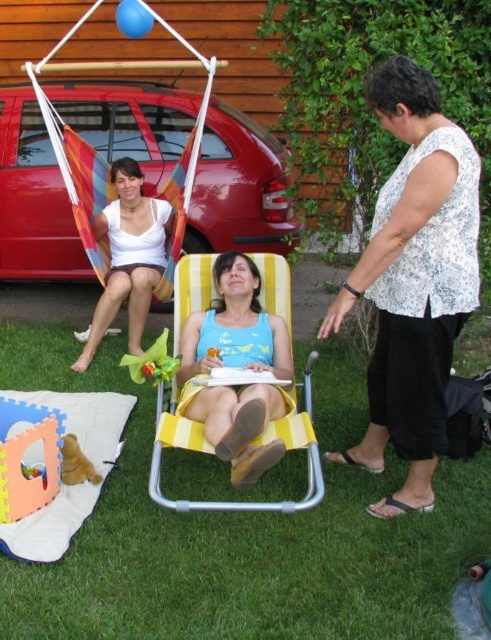
You are a parent trying to ensure your baby stays within the play mat area. The baby is currently near the soft foam play mat at lower left. Which direction should you move the metallic red car at left to block the baby from crawling away towards the right side?

To block the baby from crawling away towards the right side, you should move the metallic red car at left further to the right of the soft foam play mat at lower left so it acts as a barrier between the play mat and the right side.

You are a photographer standing behind the red car. You want to take a photo of the white dotted blouse at center and the soft foam play mat at lower left. Which object will appear higher in the photo?

The white dotted blouse at center will appear higher in the photo because it is positioned above the soft foam play mat at lower left.

You are a parent who wants to place a yellow plastic toy at center on the yellow fabric beach chair at center. Can you fit the toy on the chair?

The yellow fabric beach chair at center is bigger than the yellow plastic toy at center, so yes, the toy can fit on the chair.